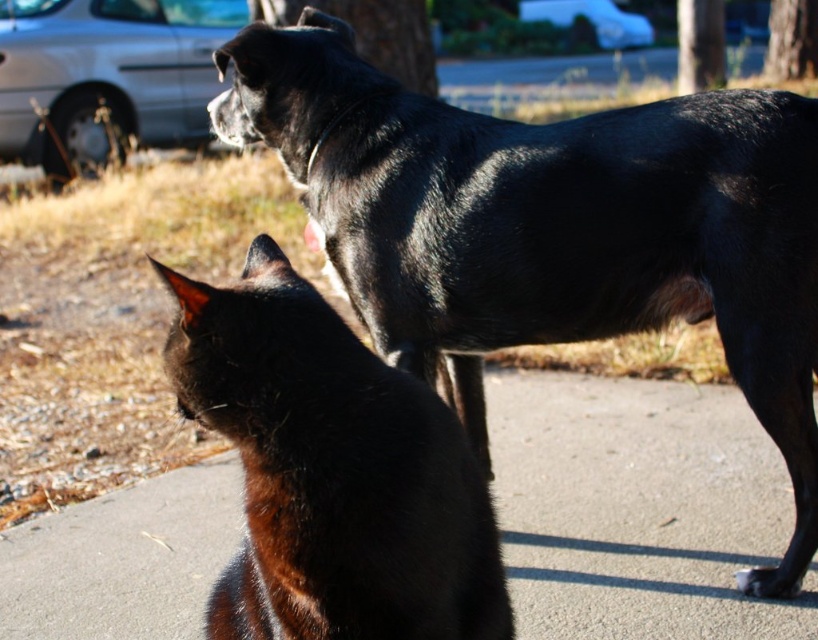
Question: Is shiny black cat at center in front of silver metallic car at upper left?

Choices:
 (A) yes
 (B) no

Answer: (A)

Question: Does smooth concrete pavement at lower center have a smaller size compared to shiny black cat at center?

Choices:
 (A) yes
 (B) no

Answer: (B)

Question: Is black shiny fur dog at center closer to camera compared to white glossy van at upper center?

Choices:
 (A) no
 (B) yes

Answer: (B)

Question: Which point is farther from the camera taking this photo?

Choices:
 (A) pyautogui.click(x=578, y=324)
 (B) pyautogui.click(x=315, y=436)
 (C) pyautogui.click(x=672, y=484)
 (D) pyautogui.click(x=762, y=588)

Answer: (C)

Question: Which of the following is the farthest from the observer?

Choices:
 (A) pos(792,620)
 (B) pos(578,273)
 (C) pos(742,580)
 (D) pos(79,138)

Answer: (D)

Question: Among these objects, which one is nearest to the camera?

Choices:
 (A) black fur paw at lower right
 (B) silver metallic car at upper left
 (C) black shiny fur dog at center
 (D) smooth concrete pavement at lower center

Answer: (C)